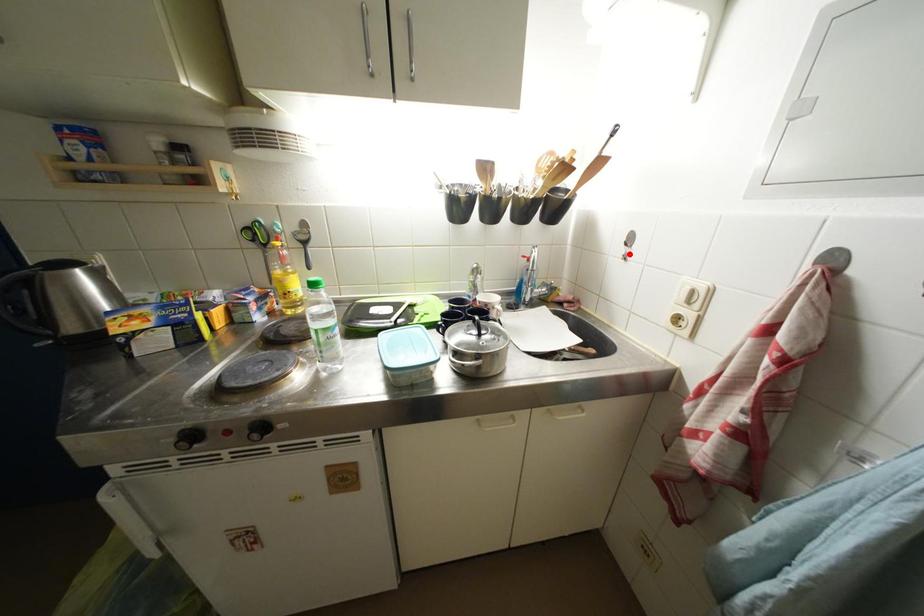
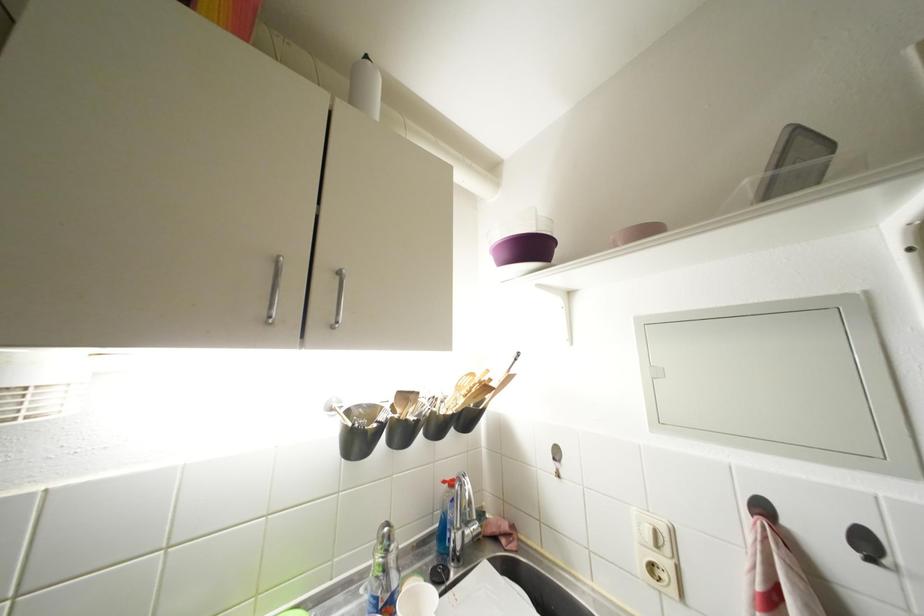
Locate, in the second image, the point that corresponds to the highlighted location in the first image.

(560, 469)